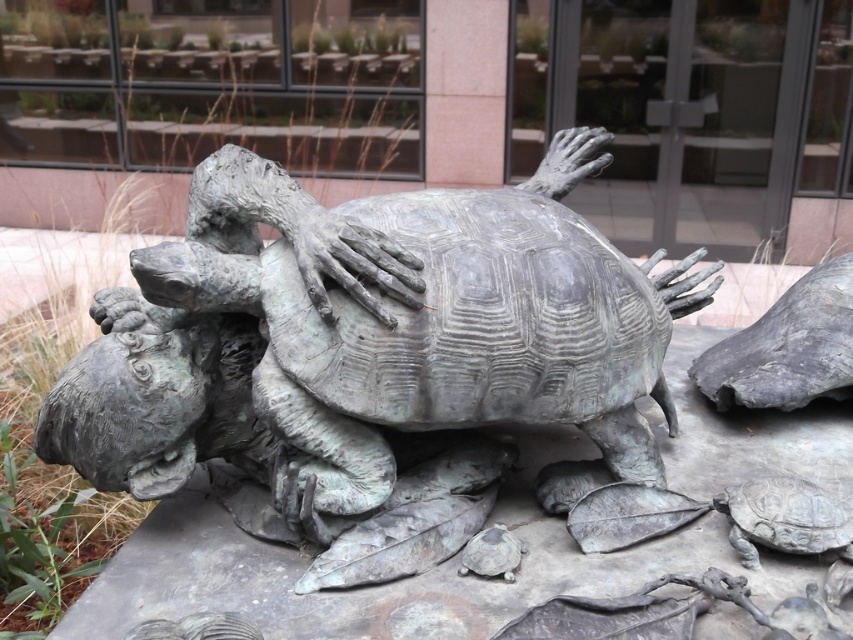
Question: Does bronze textured tortoise at center come in front of bronze textured tortoise at lower right?

Choices:
 (A) yes
 (B) no

Answer: (A)

Question: Is bronze textured tortoise at center above bronze textured tortoise at lower right?

Choices:
 (A) yes
 (B) no

Answer: (A)

Question: Can you confirm if bronze textured tortoise at center is positioned to the left of bronze textured tortoise at lower right?

Choices:
 (A) no
 (B) yes

Answer: (B)

Question: Which of the following is the farthest from the observer?

Choices:
 (A) bronze textured tortoise at center
 (B) bronze textured tortoise at lower right

Answer: (B)

Question: Among these points, which one is farthest from the camera?

Choices:
 (A) (801, 544)
 (B) (537, 176)

Answer: (B)